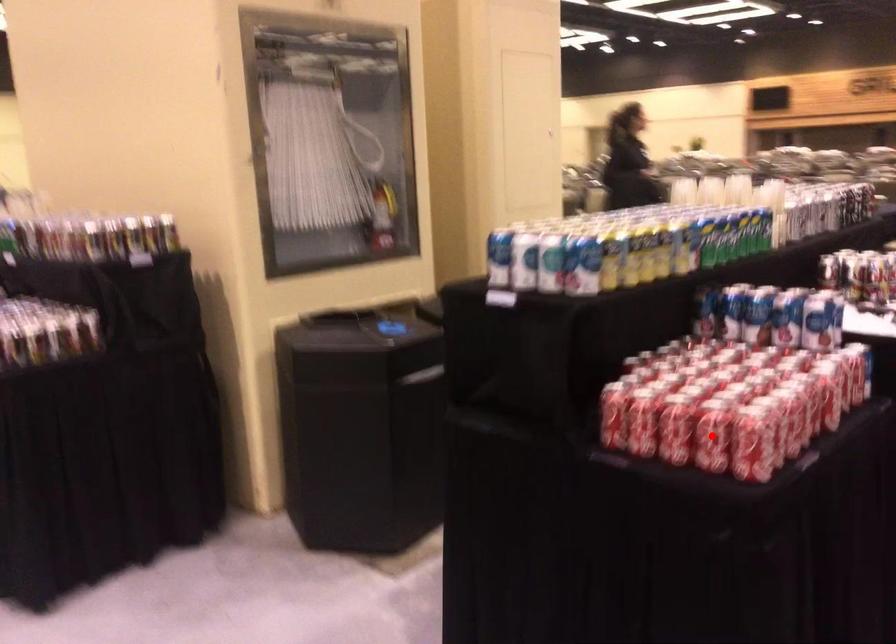
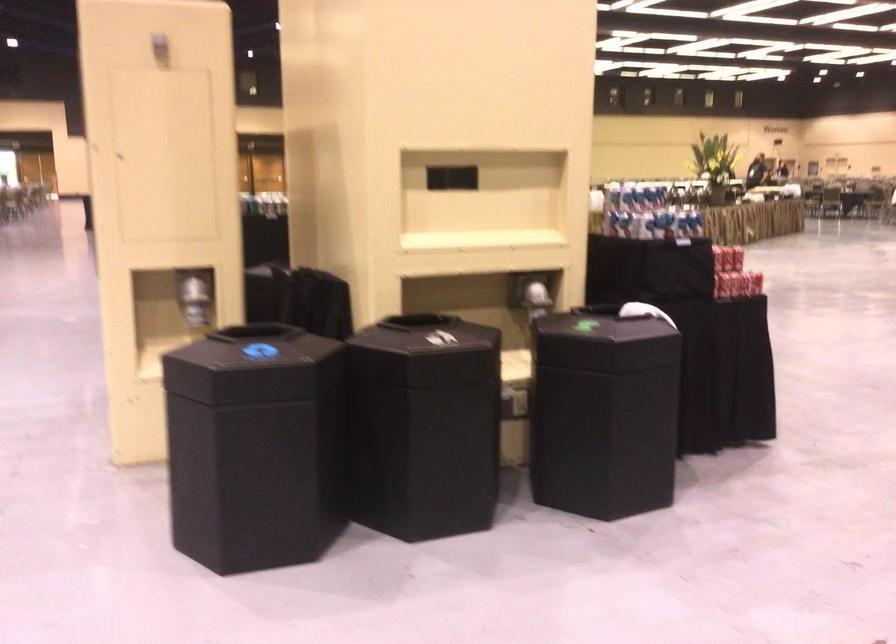
Question: I am providing you with two images of the same scene from different viewpoints. A red point is marked on the first image. Can you still see the location of the red point in image 2?

Choices:
 (A) Yes
 (B) No

Answer: (B)